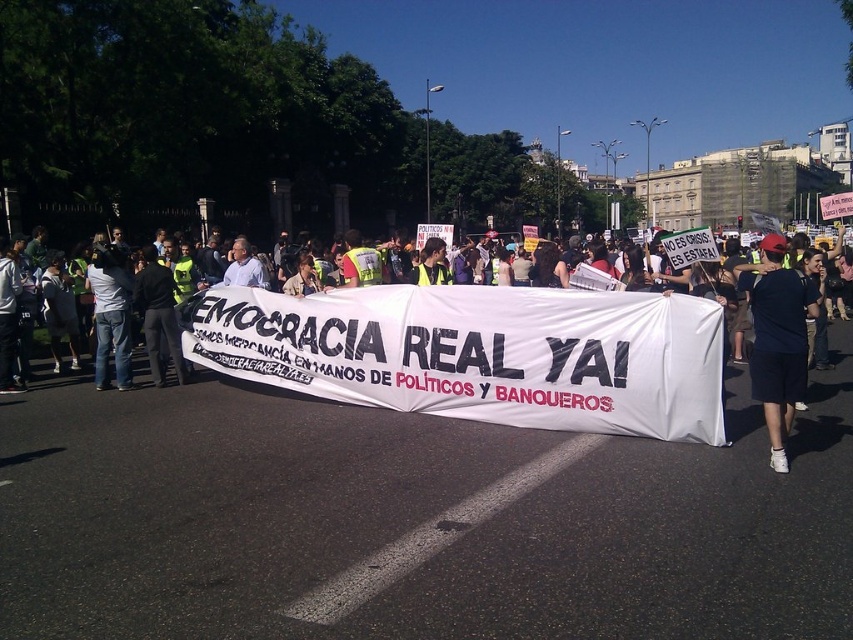
You are a photographer standing at the center of the demonstration. You want to take a photo that includes both the point at (566, 403) and the point at (753, 328). Which point should you focus on first to ensure both are in focus?

You should focus on the point at (753, 328) first because it is farther away from the camera than the point at (566, 403). By focusing on the farther point, the closer point will also be within the depth of field, ensuring both are in focus.